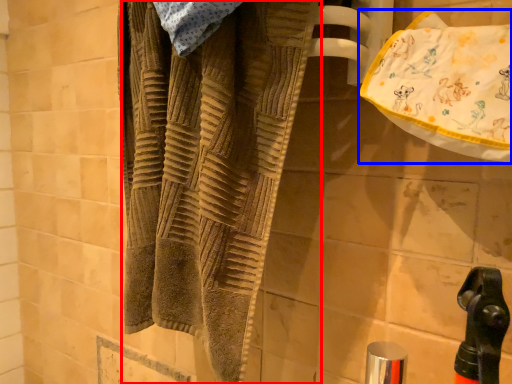
Question: Which of the following is the closest to the observer, towel (highlighted by a red box) or beach towel (highlighted by a blue box)?

Choices:
 (A) towel
 (B) beach towel

Answer: (B)